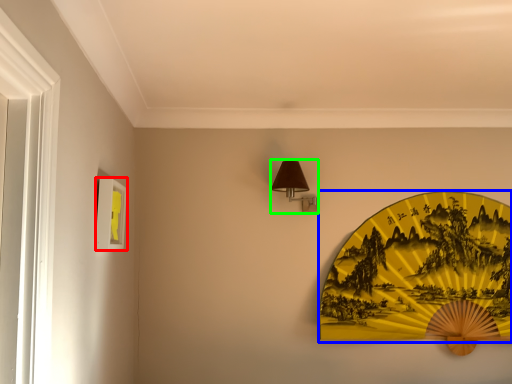
Question: Which object is the farthest from picture frame (highlighted by a red box)? Choose among these: design (highlighted by a blue box) or table lamp (highlighted by a green box).

Choices:
 (A) design
 (B) table lamp

Answer: (A)